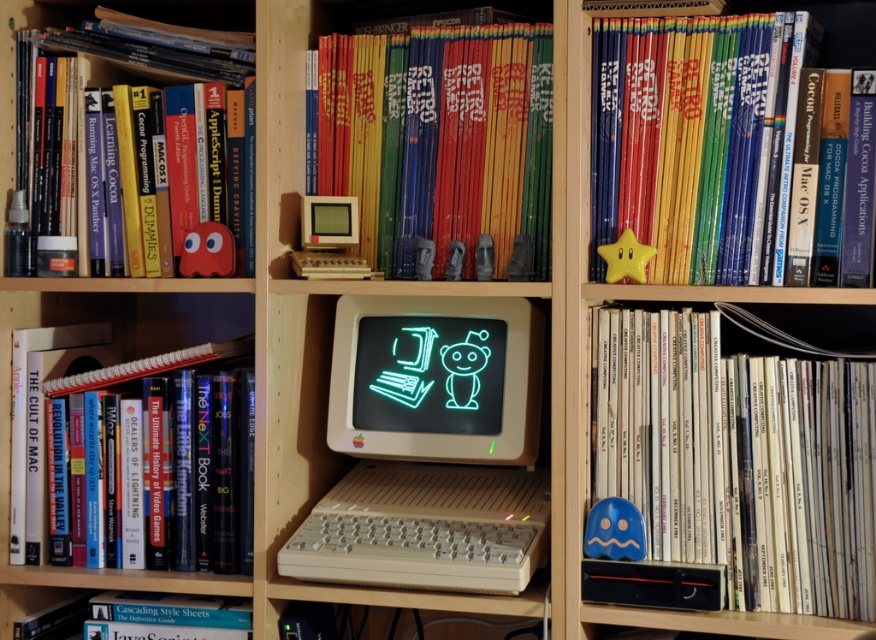
You are standing in front of the bookshelf and want to reach both the white plastic computer at center and the neon plastic monitor at center. Which object will you need to move first to access the other?

You will need to move the white plastic computer at center first because it is closer to you than the neon plastic monitor at center, which is behind it.

You are setting up a new display in a tech museum and need to place the white plastic computer at center and the neon plastic monitor at center on a shelf. According to the image, where should the computer be positioned relative to the monitor?

The white plastic computer at center should be positioned below the neon plastic monitor at center as per the image.

You are standing in front of the wooden bookshelf and want to place a new book between the point at (837, 33) and the vintage Apple computer in the center. If the book is 1.5 feet thick, will there be enough space?

The distance between the point at (837, 33) and the vintage Apple computer in the center is 4.80 feet. Since the book is only 1.5 feet thick, there is sufficient space to place it between them.